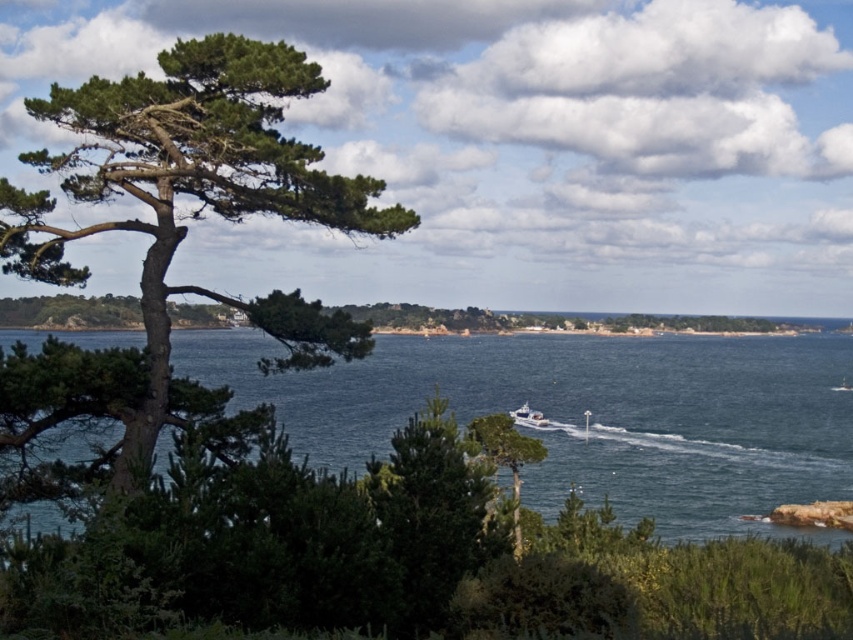
You are standing at the edge of the coast looking at the blue water at center and the green matte tree at center. Which object is nearer to you?

The blue water at center is closer to the viewer than the green matte tree at center.

You are standing at the edge of the coast looking at the scene. There is a point marked at coordinates (590, 416). What object is located at that point?

The blue water at center is located at point (590, 416).

You are standing at the edge of the scene and want to determine which object occupies more vertical space in the image. Based on the provided information, which one is taller between the blue water at center and the green rough bark tree at left?

The blue water at center has a greater height compared to the green rough bark tree at left, so the blue water at center is taller.